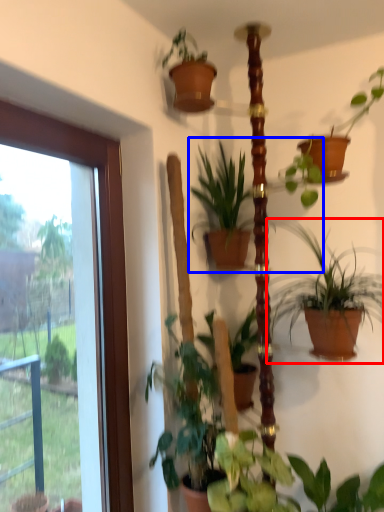
Question: Which object appears closest to the camera in this image, houseplant (highlighted by a red box) or houseplant (highlighted by a blue box)?

Choices:
 (A) houseplant
 (B) houseplant

Answer: (A)